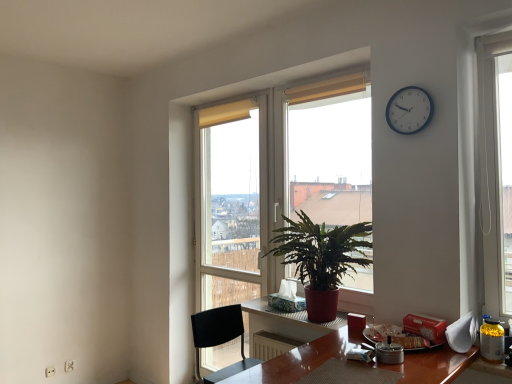
Find the location of a particular element. This screenshot has height=384, width=512. green leafy plant at center is located at coordinates (330, 157).

The image size is (512, 384). Find the location of `clock above the wooden desk at center (from a real-world perspective)`. clock above the wooden desk at center (from a real-world perspective) is located at coordinates (409, 110).

Is white plastic clock at upper right far away from wooden desk at center?

Absolutely, white plastic clock at upper right is distant from wooden desk at center.

Could you tell me if white plastic clock at upper right is facing wooden desk at center?

No, white plastic clock at upper right does not turn towards wooden desk at center.

Which object is closer to the camera taking this photo, white plastic clock at upper right or wooden desk at center?

white plastic clock at upper right is closer to the camera.

From the picture: Which is more to the left, wooden desk at center or transparent glass door at center?

transparent glass door at center is more to the left.

Is wooden desk at center positioned far away from transparent glass door at center?

Yes, wooden desk at center and transparent glass door at center are quite far apart.

Which object is further away from the camera taking this photo, wooden desk at center or transparent glass door at center?

transparent glass door at center.

Which is closer to the camera, (337,253) or (253,228)?

Point (337,253) is positioned closer to the camera compared to point (253,228).

Does green glossy plant at center have a greater height compared to transparent glass door at center?

No.

What's the angular difference between green glossy plant at center and transparent glass door at center's facing directions?

The angular difference between green glossy plant at center and transparent glass door at center is 5.54e-05 degrees.

This screenshot has height=384, width=512. Find the location of `glass door on the left of green glossy plant at center`. glass door on the left of green glossy plant at center is located at coordinates (231, 202).

Does green glossy plant at center have a larger size compared to wooden desk at center?

Correct, green glossy plant at center is larger in size than wooden desk at center.

Is green glossy plant at center to the right of wooden desk at center from the viewer's perspective?

Indeed, green glossy plant at center is positioned on the right side of wooden desk at center.

From the image's perspective, is green glossy plant at center located beneath wooden desk at center?

No, from the image's perspective, green glossy plant at center is not below wooden desk at center.

Measure the distance between green glossy plant at center and wooden desk at center.

A distance of 11.11 inches exists between green glossy plant at center and wooden desk at center.

Considering the relative sizes of transparent glass door at center and wooden desk at center in the image provided, is transparent glass door at center taller than wooden desk at center?

Yes.

Which is closer, (260,221) or (241,304)?

Point (260,221).

Choose the correct answer: Is transparent glass door at center inside wooden desk at center or outside it?

transparent glass door at center exists outside the volume of wooden desk at center.

Does transparent glass door at center have a smaller size compared to wooden desk at center?

Actually, transparent glass door at center might be larger than wooden desk at center.

Is white plastic clock at upper right far from black plastic chair at lower center?

white plastic clock at upper right is far away from black plastic chair at lower center.

Who is bigger, white plastic clock at upper right or black plastic chair at lower center?

With larger size is black plastic chair at lower center.

Can you confirm if white plastic clock at upper right is shorter than black plastic chair at lower center?

Correct, white plastic clock at upper right is not as tall as black plastic chair at lower center.

Which is more to the left, white plastic clock at upper right or green leafy plant at center?

Positioned to the left is green leafy plant at center.

Is point (392, 126) closer to camera compared to point (292, 164)?

Yes, point (392, 126) is in front of point (292, 164).

Is white plastic clock at upper right bigger or smaller than green leafy plant at center?

white plastic clock at upper right is smaller than green leafy plant at center.

In the scene shown: Does white plastic clock at upper right turn towards green leafy plant at center?

No.

Locate an element on the screen. The image size is (512, 384). clock above the wooden desk at center (from the image's perspective) is located at coordinates (409, 110).

Where is `glass door that is behind the wooden desk at center`? The height and width of the screenshot is (384, 512). glass door that is behind the wooden desk at center is located at coordinates (231, 202).

Based on their spatial positions, is wooden desk at center or white plastic clock at upper right closer to green leafy plant at center?

white plastic clock at upper right.

In the scene shown: Based on their spatial positions, is black plastic chair at lower center or white plastic clock at upper right closer to transparent glass door at center?

black plastic chair at lower center.

Based on their spatial positions, is white plastic clock at upper right or transparent glass door at center closer to green glossy plant at center?

The object closer to green glossy plant at center is white plastic clock at upper right.

In the scene shown: Based on their spatial positions, is wooden desk at center or green leafy plant at center closer to transparent glass door at center?

green leafy plant at center is positioned closer to the anchor transparent glass door at center.

Estimate the real-world distances between objects in this image. Which object is further from green leafy plant at center, white plastic clock at upper right or black plastic chair at lower center?

Among the two, black plastic chair at lower center is located further to green leafy plant at center.

From the image, which object appears to be farther from wooden desk at center, green leafy plant at center or green glossy plant at center?

green leafy plant at center.

When comparing their distances from white plastic clock at upper right, does green glossy plant at center or black plastic chair at lower center seem further?

The object further to white plastic clock at upper right is black plastic chair at lower center.

Based on their spatial positions, is black plastic chair at lower center or transparent glass door at center closer to green glossy plant at center?

Among the two, black plastic chair at lower center is located nearer to green glossy plant at center.

I want to click on houseplant between green leafy plant at center and black plastic chair at lower center in the vertical direction, so click(x=321, y=259).

Locate an element on the screen. The image size is (512, 384). houseplant between green leafy plant at center and wooden desk at center vertically is located at coordinates (321, 259).

Identify the location of window screen between white plastic clock at upper right and black plastic chair at lower center vertically. (330, 157).

Find the location of a particular element. window screen positioned between black plastic chair at lower center and transparent glass door at center from near to far is located at coordinates (330, 157).